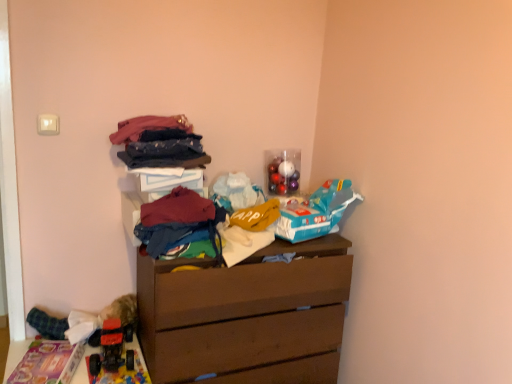
Find the location of a particular element. free space above denim jeans at upper center, which is the 2th clothing from top to bottom (from a real-world perspective) is located at coordinates (162, 139).